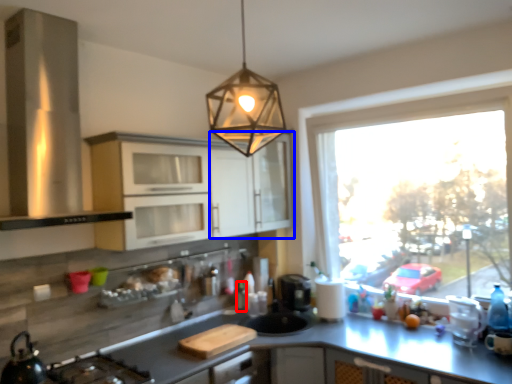
Question: Which object is further to the camera taking this photo, bottle (highlighted by a red box) or cabinetry (highlighted by a blue box)?

Choices:
 (A) bottle
 (B) cabinetry

Answer: (A)